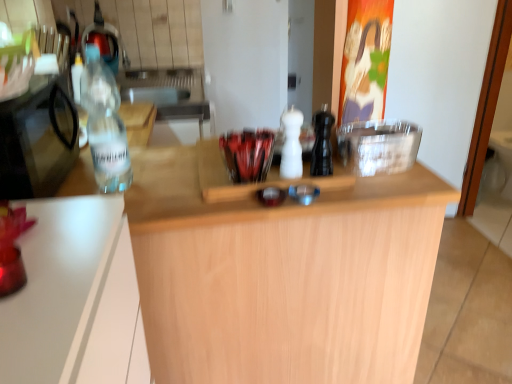
Where is `free space to the right of clear glass bottle at left, the first bottle in the left-to-right sequence`? The height and width of the screenshot is (384, 512). free space to the right of clear glass bottle at left, the first bottle in the left-to-right sequence is located at coordinates (178, 179).